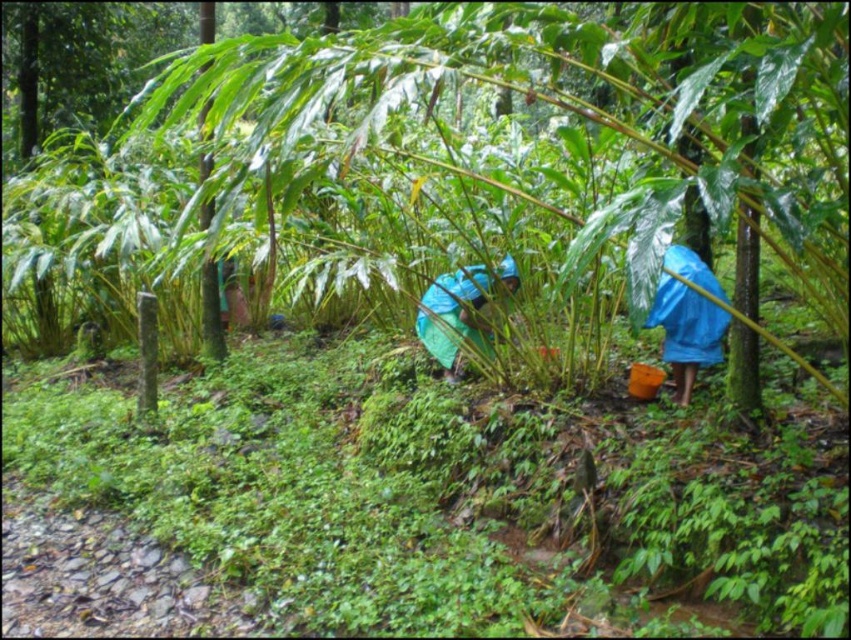
You are planning to take shelter from the rain using the items available in the scene. You have the blue waterproof jacket at right and the blue fabric at center. Which item would provide better coverage against the rain?

The blue fabric at center would provide better coverage against the rain because it has a larger size compared to the blue waterproof jacket at right.

You are standing in the forest and want to reach the point marked at coordinates [675,356]. If your average walking pace is 3 feet per second, how many seconds will it take you to reach that point?

The point at coordinates [675,356] is 20.70 feet away from the viewer. At a walking pace of 3 feet per second, it would take approximately 6.9 seconds to reach the point.

You are a hiker who just arrived at the forest and see the blue waterproof jacket at right and the blue fabric at center. Which one is located to the right of the other?

The blue waterproof jacket at right is positioned on the right side of blue fabric at center.